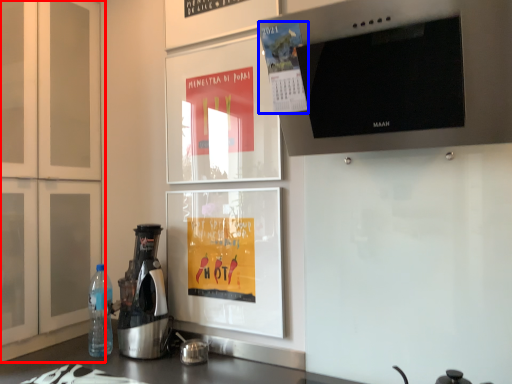
Question: Which point is further to the camera, cabinetry (highlighted by a red box) or poster (highlighted by a blue box)?

Choices:
 (A) cabinetry
 (B) poster

Answer: (A)